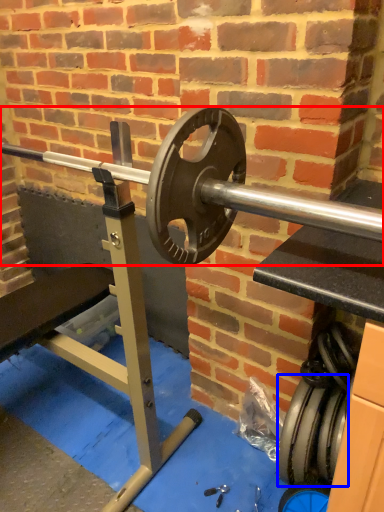
Question: Among these objects, which one is farthest to the camera, barbell (highlighted by a red box) or tire (highlighted by a blue box)?

Choices:
 (A) barbell
 (B) tire

Answer: (B)